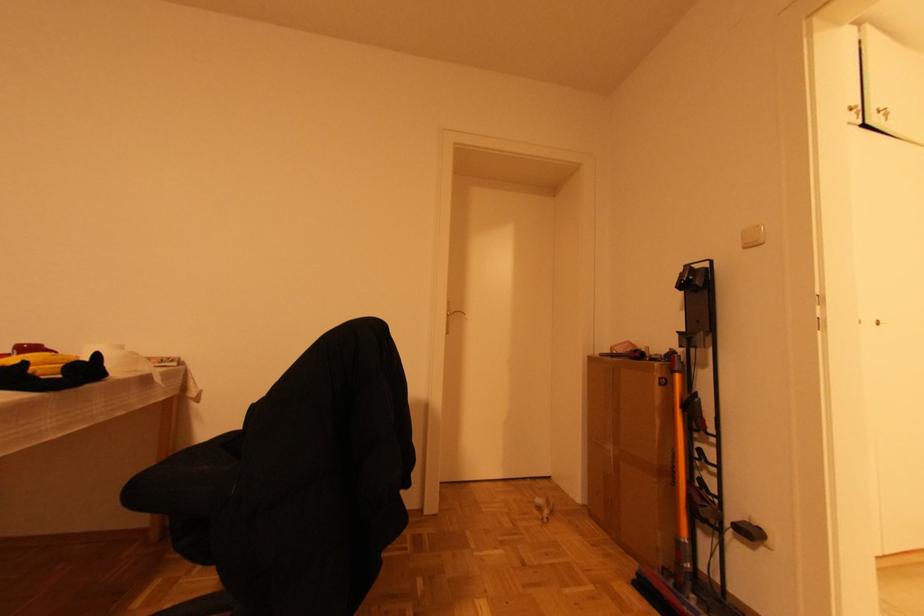
Locate an element on the screen. white light switch is located at coordinates (752, 236).